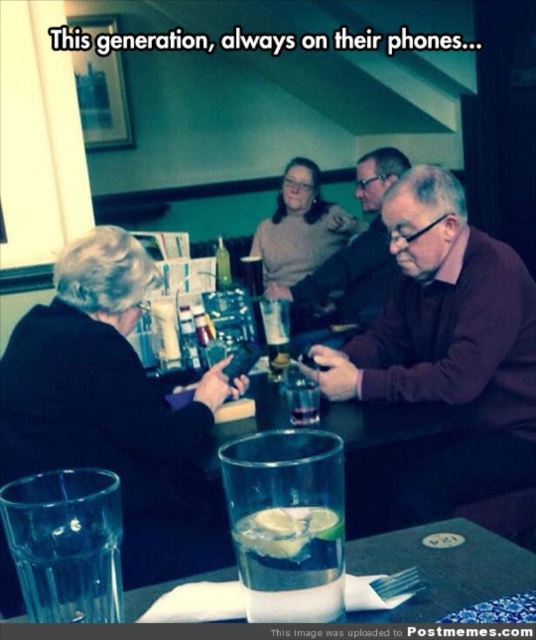
Can you confirm if matte brown sweater at center is positioned to the right of clear glass at center?

Yes, matte brown sweater at center is to the right of clear glass at center.

Who is positioned more to the right, matte brown sweater at center or clear glass at center?

matte brown sweater at center is more to the right.

Which is behind, point (323, 291) or point (280, 372)?

The point (323, 291) is behind.

At what (x,y) coordinates should I click in order to perform the action: click on matte brown sweater at center. Please return your answer as a coordinate pair (x, y). The image size is (536, 640). Looking at the image, I should click on (355, 252).

Is green glass bottle at center wider than clear glass at center?

Correct, the width of green glass bottle at center exceeds that of clear glass at center.

Which is more to the left, green glass bottle at center or clear glass at center?

From the viewer's perspective, green glass bottle at center appears more on the left side.

Measure the distance between green glass bottle at center and camera.

2.18 meters

I want to click on green glass bottle at center, so click(x=222, y=266).

Measure the distance between clear glass at lower center and clear glass with lime slices at center.

A distance of 8.18 inches exists between clear glass at lower center and clear glass with lime slices at center.

Which is below, clear glass at lower center or clear glass with lime slices at center?

clear glass at lower center is lower down.

Is point (441, 604) farther from viewer compared to point (272, 513)?

That is True.

You are a GUI agent. You are given a task and a screenshot of the screen. Output one action in this format:
    pyautogui.click(x=<x>, y=<y>)
    Task: Click on the clear glass at lower center
    This screenshot has width=536, height=640.
    Given the screenshot: What is the action you would take?
    pyautogui.click(x=442, y=568)